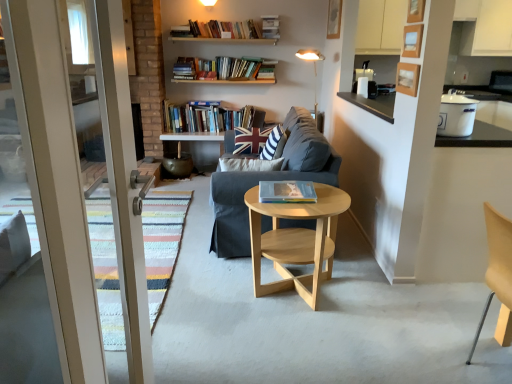
At what (x,y) coordinates should I click in order to perform the action: click on empty space that is ontop of hardcover book at center, placed as the 2th book when sorted from top to bottom. Please return your answer as a coordinate pair (x, y). Looking at the image, I should click on (285, 187).